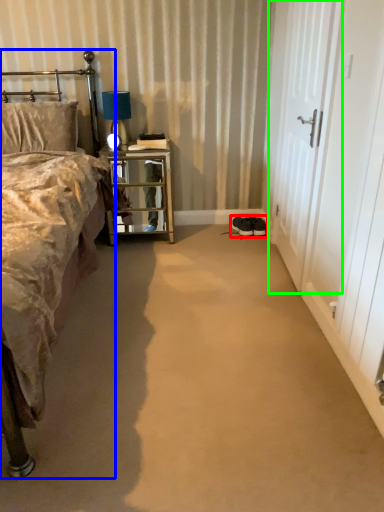
Question: Based on their relative distances, which object is nearer to footwear (highlighted by a red box)? Choose from bed (highlighted by a blue box) and screen door (highlighted by a green box).

Choices:
 (A) bed
 (B) screen door

Answer: (B)